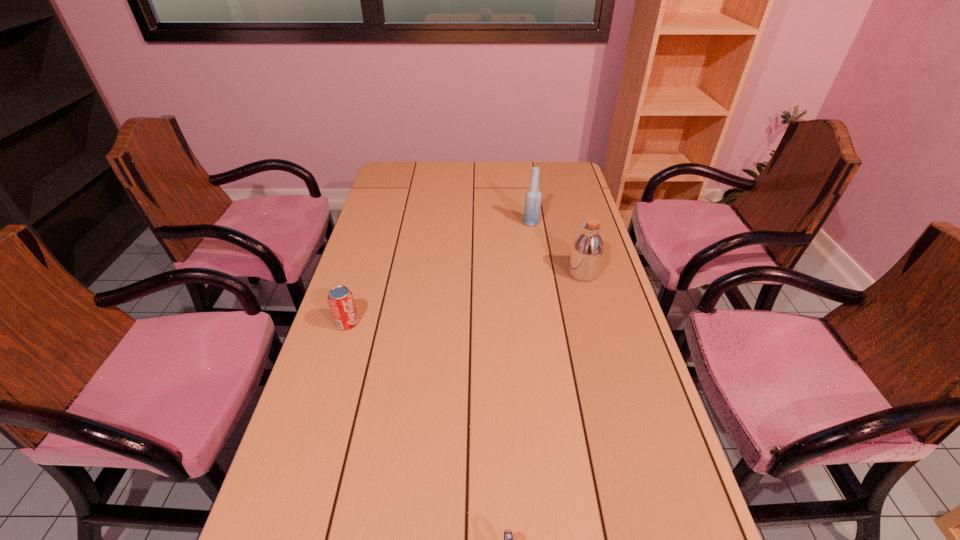
Locate an element on the screen. This screenshot has height=540, width=960. free space between the rightmost object and the farthest object is located at coordinates (x=557, y=248).

Image resolution: width=960 pixels, height=540 pixels. In order to click on vacant space that's between the soda can and the third object from left to right in this screenshot , I will do `click(440, 273)`.

Image resolution: width=960 pixels, height=540 pixels. Find the location of `empty space that is in between the nearer bottle and the left bottle`. empty space that is in between the nearer bottle and the left bottle is located at coordinates (557, 248).

Image resolution: width=960 pixels, height=540 pixels. Find the location of `empty location between the soda can and the nearer bottle`. empty location between the soda can and the nearer bottle is located at coordinates (465, 298).

The height and width of the screenshot is (540, 960). Find the location of `free space between the rightmost object and the leftmost object`. free space between the rightmost object and the leftmost object is located at coordinates (465, 298).

Where is `object that is the second nearest to the right bottle`? This screenshot has height=540, width=960. object that is the second nearest to the right bottle is located at coordinates (340, 299).

Point out which object is positioned as the third nearest to the second object from left to right. Please provide its 2D coordinates. Your answer should be formatted as a tuple, i.e. [(x, y)], where the tuple contains the x and y coordinates of a point satisfying the conditions above.

[(532, 208)]

Find the location of a particular element. This screenshot has width=960, height=540. vacant space that satisfies the following two spatial constraints: 1. on the back side of the third nearest object; 2. on the left side of the second nearest object is located at coordinates (363, 272).

The width and height of the screenshot is (960, 540). Find the location of `free space that satisfies the following two spatial constraints: 1. on the back side of the leftmost object; 2. on the right side of the right bottle`. free space that satisfies the following two spatial constraints: 1. on the back side of the leftmost object; 2. on the right side of the right bottle is located at coordinates (363, 272).